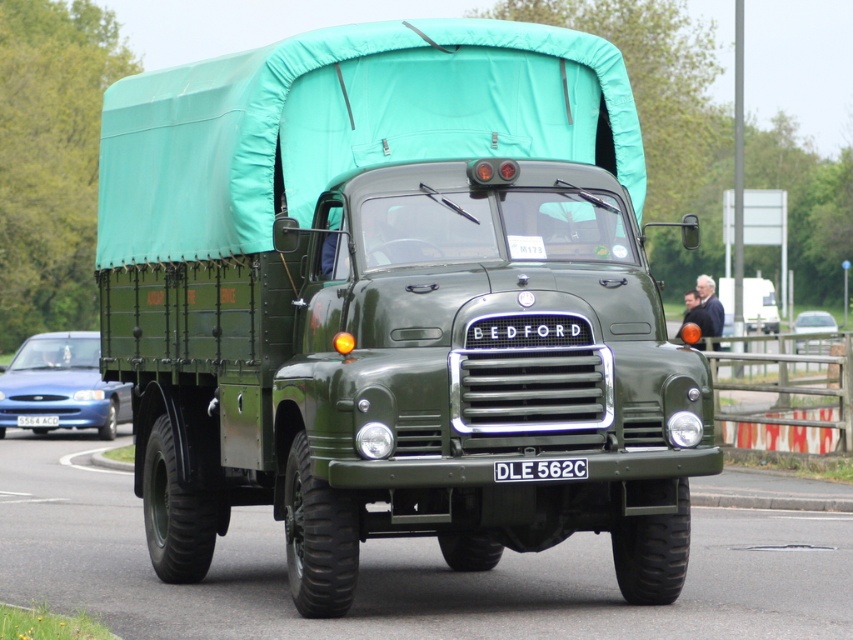
Is green matte truck at center smaller than matte green coach at center?

Indeed, green matte truck at center has a smaller size compared to matte green coach at center.

Measure the distance between green matte truck at center and matte green coach at center.

green matte truck at center and matte green coach at center are 6.68 meters apart from each other.

Does point (345, 584) come behind point (720, 328)?

No.

What are the coordinates of `green matte truck at center` in the screenshot? It's located at (395, 301).

Does black plastic license plate at center have a lesser height compared to white plastic license plate at center?

Indeed, black plastic license plate at center has a lesser height compared to white plastic license plate at center.

Is black plastic license plate at center bigger than white plastic license plate at center?

Actually, black plastic license plate at center might be smaller than white plastic license plate at center.

Between point (544, 470) and point (41, 413), which one is positioned in front?

Point (544, 470) is more forward.

At what (x,y) coordinates should I click in order to perform the action: click on black plastic license plate at center. Please return your answer as a coordinate pair (x, y). Image resolution: width=853 pixels, height=640 pixels. Looking at the image, I should click on point(540,468).

Who is lower down, metallic silver car at center or matte green coach at center?

metallic silver car at center is below.

Describe the element at coordinates (814, 323) in the screenshot. I see `metallic silver car at center` at that location.

You are a GUI agent. You are given a task and a screenshot of the screen. Output one action in this format:
    pyautogui.click(x=<x>, y=<y>)
    Task: Click on the metallic silver car at center
    The height and width of the screenshot is (640, 853).
    Given the screenshot: What is the action you would take?
    pyautogui.click(x=814, y=323)